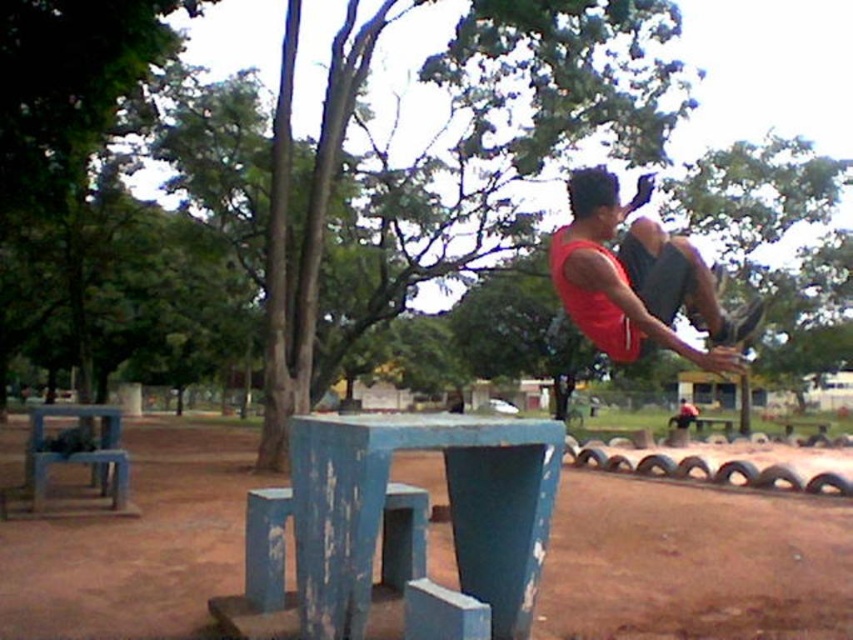
You are a photographer trying to capture the scene of the blue painted wood table at center and the matte red tank top at upper right. Based on their positions, which object should you focus on first to ensure both are in frame?

The blue painted wood table at center is positioned on the left side of matte red tank top at upper right, so you should focus on the blue painted wood table at center first to ensure both are in frame.

You are standing in the park and want to place a small potted plant between the blue painted concrete at center and the blue painted wood table at center. Which object should you place the plant closer to in order for it to be closer to the viewer?

The blue painted concrete at center is further to the viewer than blue painted wood table at center, so you should place the plant closer to the blue painted concrete at center to be closer to the viewer.